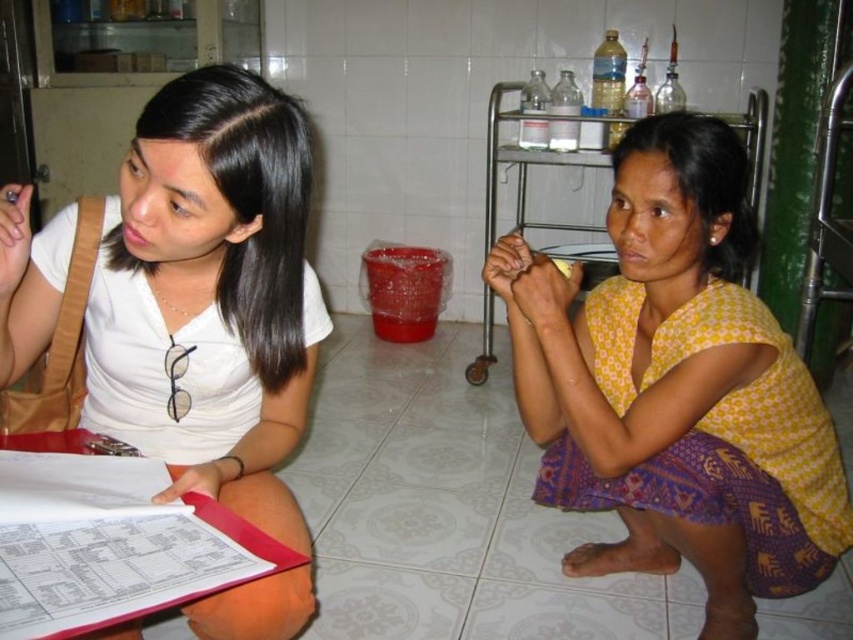
You are an assistant who needs to determine if a document placed on the pink plastic clipboard at lower left will be fully visible to someone looking at the white matte shirt at upper left. Based on their sizes, can the document on the clipboard be seen in full?

The white matte shirt at upper left is larger than the pink plastic clipboard at lower left. Since the shirt is bigger, it might block the view of the clipboard, making the document partially or fully obscured. Therefore, the document on the pink plastic clipboard at lower left may not be fully visible to someone looking at the white matte shirt at upper left.